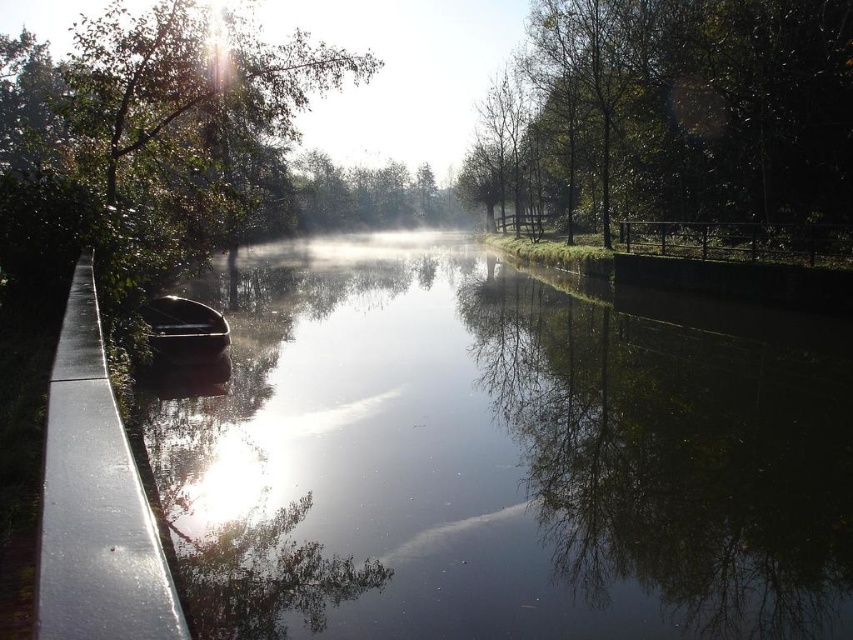
Can you confirm if green leafy tree at upper right is wider than shiny black canoe at center?

Yes, green leafy tree at upper right is wider than shiny black canoe at center.

Which is in front, point (770, 132) or point (152, 324)?

Point (152, 324) is in front.

Between point (508, 92) and point (189, 307), which one is positioned in front?

Point (189, 307) is more forward.

At what (x,y) coordinates should I click in order to perform the action: click on green leafy tree at upper right. Please return your answer as a coordinate pair (x, y). This screenshot has width=853, height=640. Looking at the image, I should click on (677, 113).

Who is more distant from viewer, [119,208] or [186,316]?

The point [186,316] is behind.

In the scene shown: Does green leafy tree at left have a lesser width compared to shiny black canoe at center?

In fact, green leafy tree at left might be wider than shiny black canoe at center.

Who is more forward, (219, 198) or (190, 356)?

Point (190, 356) is in front.

Image resolution: width=853 pixels, height=640 pixels. I want to click on green leafy tree at left, so click(x=148, y=132).

Is point (785, 332) positioned behind point (759, 81)?

No.

Is black glossy water at left thinner than green leafy tree at upper right?

Incorrect, black glossy water at left's width is not less than green leafy tree at upper right's.

Where is `black glossy water at left`? black glossy water at left is located at coordinates (492, 460).